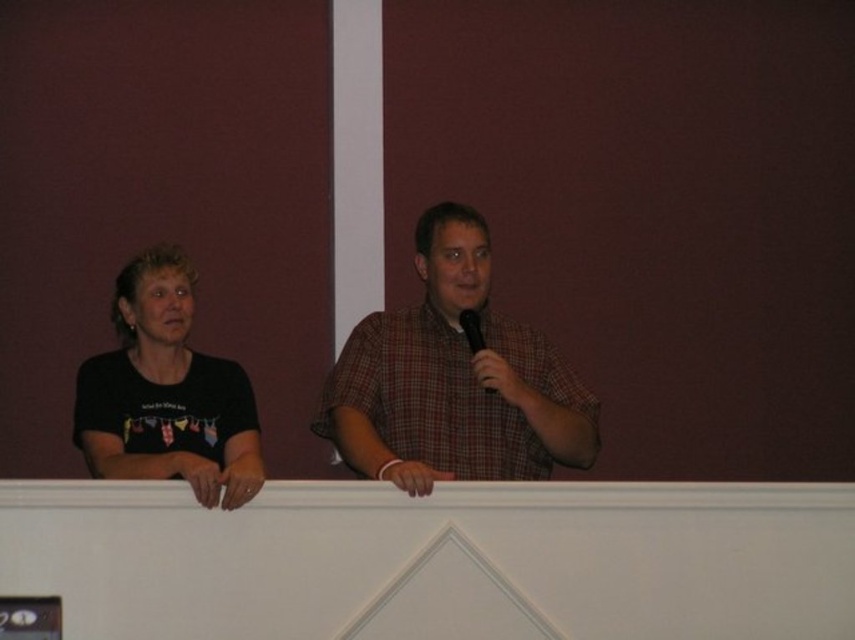
There are two people in the scene. The first is a woman wearing a black T shirt with small flags or banners on the left. The second is a man in a plaid shirt at center. How far apart are they?

They are 7.81 feet apart.

Based on the coordinates provided, can you identify which object is located at point (453, 380) in the scene?

The point at coordinates (453, 380) marks the plaid shirt at center.